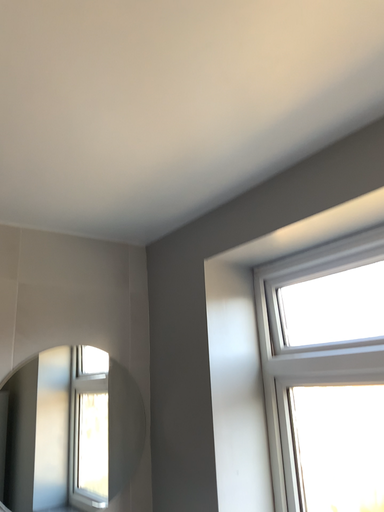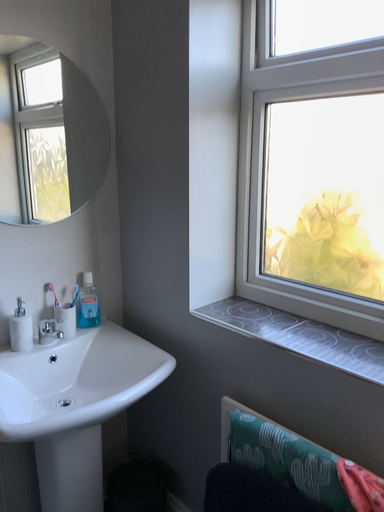
Question: How did the camera likely rotate when shooting the video?

Choices:
 (A) rotated left
 (B) rotated right

Answer: (B)